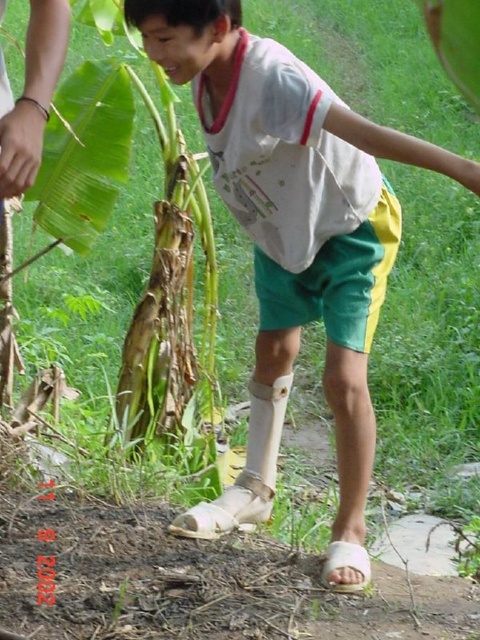
Question: Where is white matte cast at lower center located in relation to green matte banana leaf at left in the image?

Choices:
 (A) above
 (B) below

Answer: (B)

Question: Can you confirm if white matte cast at lower center is smaller than green matte banana leaf at left?

Choices:
 (A) no
 (B) yes

Answer: (A)

Question: Can you confirm if white matte cast at lower center is smaller than green matte banana leaf at left?

Choices:
 (A) yes
 (B) no

Answer: (B)